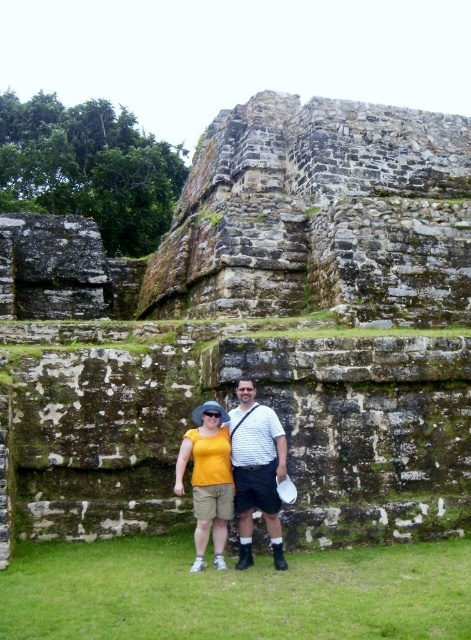
Question: Which point appears closest to the camera in this image?

Choices:
 (A) (211, 428)
 (B) (267, 512)

Answer: (B)

Question: Is white striped shirt at center thinner than yellow matte shirt at center?

Choices:
 (A) no
 (B) yes

Answer: (B)

Question: Is white striped shirt at center smaller than yellow matte shirt at center?

Choices:
 (A) yes
 (B) no

Answer: (A)

Question: Is white striped shirt at center wider than yellow matte shirt at center?

Choices:
 (A) no
 (B) yes

Answer: (A)

Question: Which point is farther from the camera taking this photo?

Choices:
 (A) (284, 449)
 (B) (213, 506)

Answer: (A)